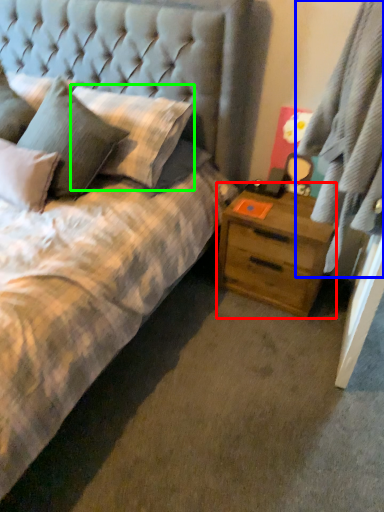
Question: Considering the real-world distances, which object is farthest from nightstand (highlighted by a red box)? curtain (highlighted by a blue box) or pillow (highlighted by a green box)?

Choices:
 (A) curtain
 (B) pillow

Answer: (B)